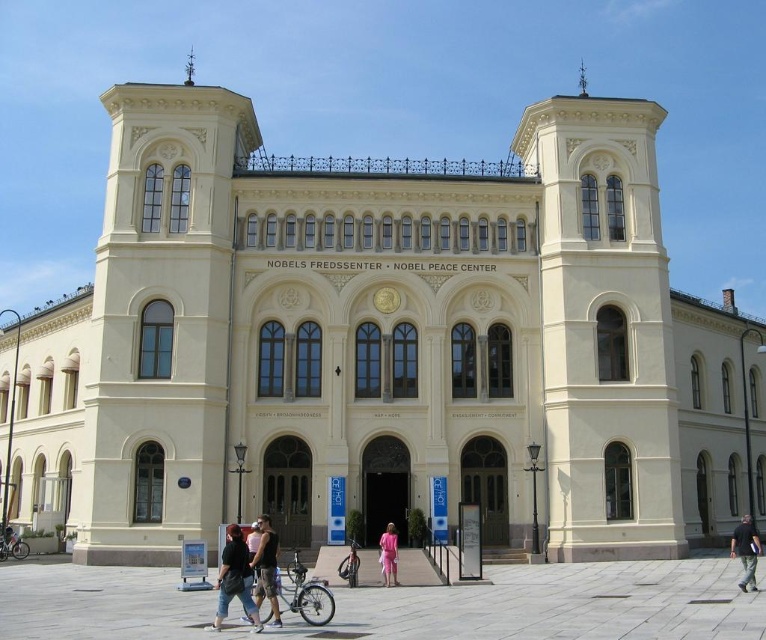
Question: Estimate the real-world distances between objects in this image. Which object is farther from the dark brown leather jacket at center?

Choices:
 (A) black cotton shirt at center
 (B) dark blue jeans at lower center

Answer: (A)

Question: Is dark brown leather jacket at center above pink fabric dress at center?

Choices:
 (A) yes
 (B) no

Answer: (A)

Question: Observing the image, what is the correct spatial positioning of dark blue jeans at lower center in reference to pink fabric dress at center?

Choices:
 (A) below
 (B) above

Answer: (B)

Question: Among these points, which one is nearest to the camera?

Choices:
 (A) (218, 573)
 (B) (394, 582)

Answer: (B)

Question: Estimate the real-world distances between objects in this image. Which object is farther from the pink fabric dress at center?

Choices:
 (A) dark brown leather jacket at center
 (B) dark blue jeans at lower center

Answer: (B)

Question: Is dark brown leather jacket at center further to camera compared to black cotton shirt at center?

Choices:
 (A) yes
 (B) no

Answer: (B)